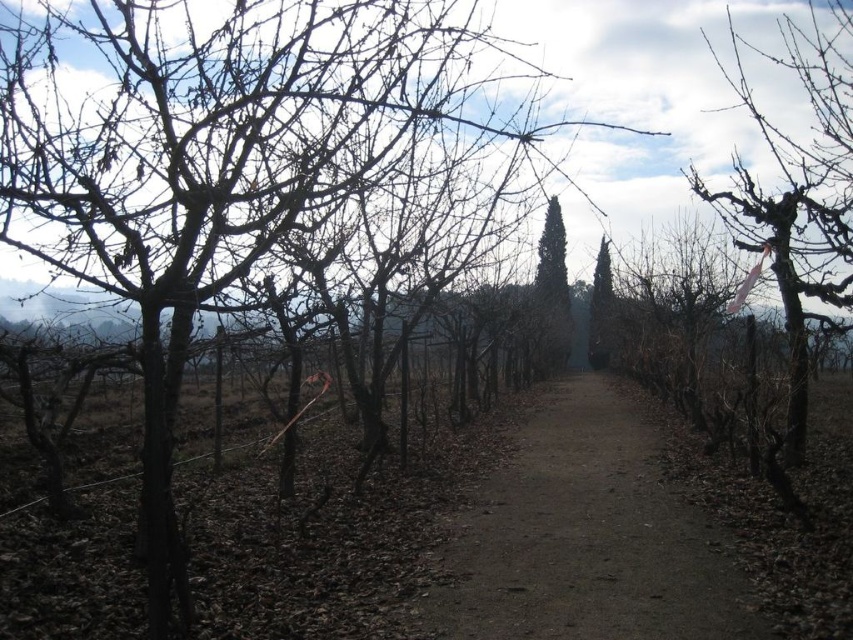
Is brown dirt path at center to the left of green textured tree at center from the viewer's perspective?

Correct, you'll find brown dirt path at center to the left of green textured tree at center.

In order to click on brown dirt path at center in this screenshot , I will do `click(583, 538)`.

This screenshot has width=853, height=640. Describe the element at coordinates (583, 538) in the screenshot. I see `brown dirt path at center` at that location.

Image resolution: width=853 pixels, height=640 pixels. In order to click on brown dirt path at center in this screenshot , I will do `click(583, 538)`.

Who is shorter, pink ribbon at right or green textured cypress at center?

Standing shorter between the two is green textured cypress at center.

Between pink ribbon at right and green textured cypress at center, which one appears on the right side from the viewer's perspective?

From the viewer's perspective, pink ribbon at right appears more on the right side.

Is point (799, 195) farther from camera compared to point (541, 337)?

No.

Where is `pink ribbon at right`? The width and height of the screenshot is (853, 640). pink ribbon at right is located at coordinates (799, 193).

Is the position of brown dirt path at center more distant than that of green textured cypress at center?

No, brown dirt path at center is closer to the viewer.

Who is positioned more to the right, brown dirt path at center or green textured cypress at center?

From the viewer's perspective, green textured cypress at center appears more on the right side.

You are a GUI agent. You are given a task and a screenshot of the screen. Output one action in this format:
    pyautogui.click(x=<x>, y=<y>)
    Task: Click on the brown dirt path at center
    
    Given the screenshot: What is the action you would take?
    pyautogui.click(x=583, y=538)